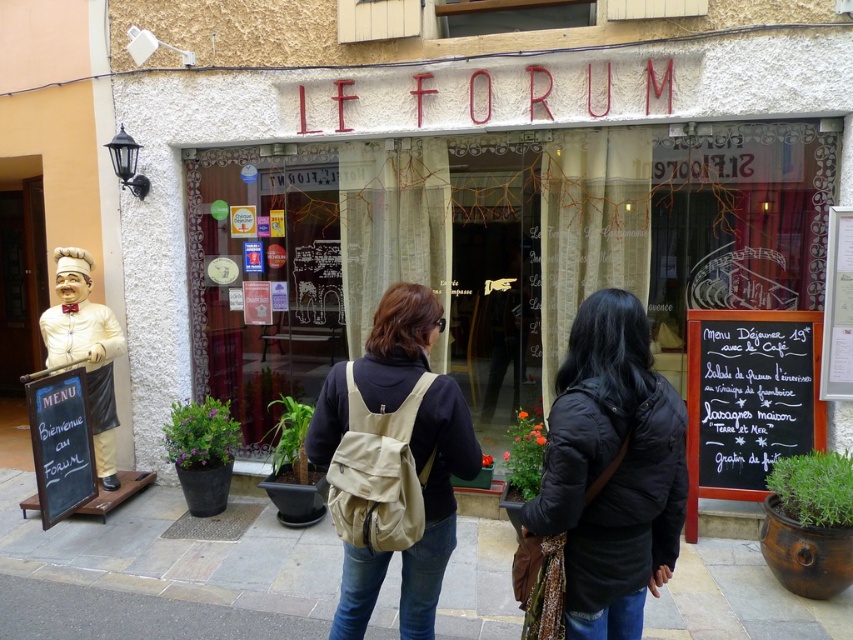
Question: Which object appears farthest from the camera in this image?

Choices:
 (A) beige fabric backpack at center
 (B) black chalkboard menu at right

Answer: (B)

Question: Among these points, which one is farthest from the camera?

Choices:
 (A) pos(738,492)
 (B) pos(502,305)

Answer: (B)

Question: Can you confirm if beige fabric backpack at center is positioned to the left of black chalkboard menu at right?

Choices:
 (A) no
 (B) yes

Answer: (B)

Question: Is translucent glass shop window at center thinner than beige fabric backpack at center?

Choices:
 (A) no
 (B) yes

Answer: (A)

Question: Where is translucent glass shop window at center located in relation to white porcelain statue at left in the image?

Choices:
 (A) below
 (B) above

Answer: (B)

Question: Which of these objects is positioned closest to the black matte jacket at center?

Choices:
 (A) black chalkboard menu at right
 (B) beige fabric backpack at center
 (C) translucent glass shop window at center

Answer: (B)